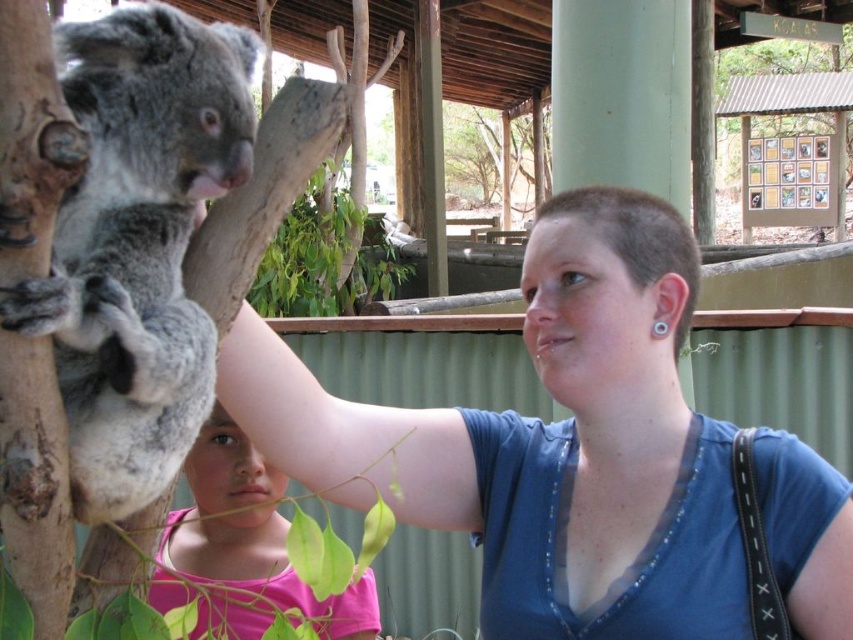
Question: Which is farther from the matte gray koala at left?

Choices:
 (A) gray furry koala at left
 (B) pink fabric shirt at lower left

Answer: (B)

Question: Does matte gray koala at left have a greater width compared to pink fabric shirt at lower left?

Choices:
 (A) yes
 (B) no

Answer: (A)

Question: Can you confirm if matte gray koala at left is positioned below pink fabric shirt at lower left?

Choices:
 (A) no
 (B) yes

Answer: (A)

Question: Which point is closer to the camera?

Choices:
 (A) (106, 243)
 (B) (160, 563)
 (C) (492, 442)

Answer: (A)

Question: Which object appears closest to the camera in this image?

Choices:
 (A) matte gray koala at left
 (B) pink fabric shirt at lower left

Answer: (B)

Question: Is matte gray koala at left in front of pink fabric shirt at lower left?

Choices:
 (A) no
 (B) yes

Answer: (A)